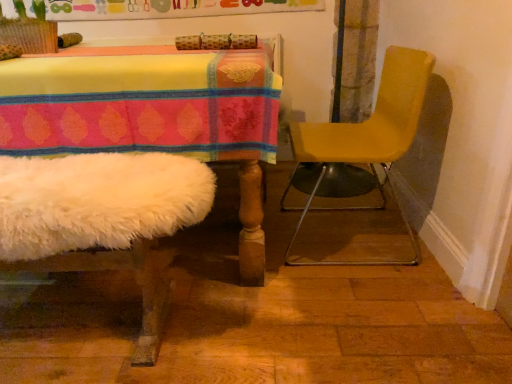
Find the location of a particular element. The width and height of the screenshot is (512, 384). free spot below matte yellow chair at right (from a real-world perspective) is located at coordinates (334, 238).